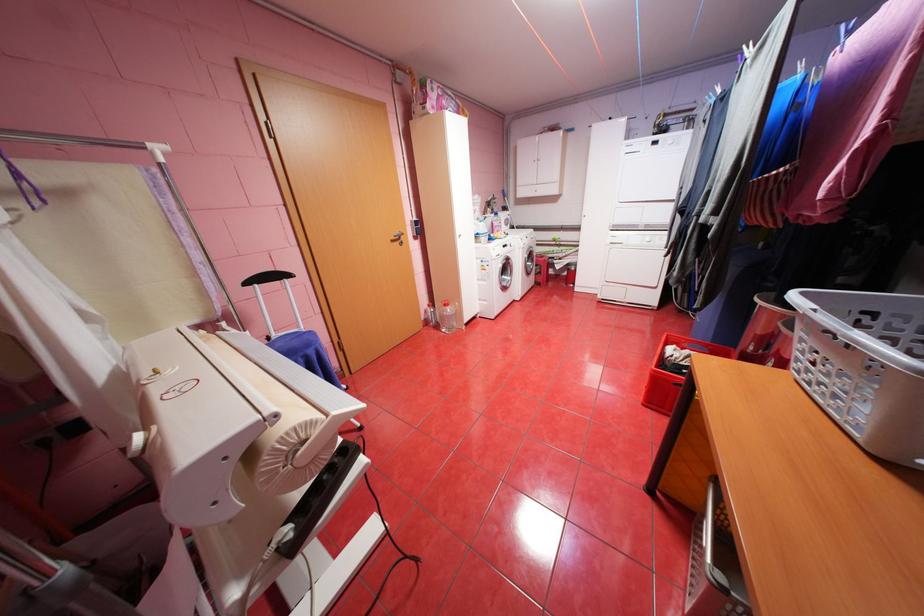
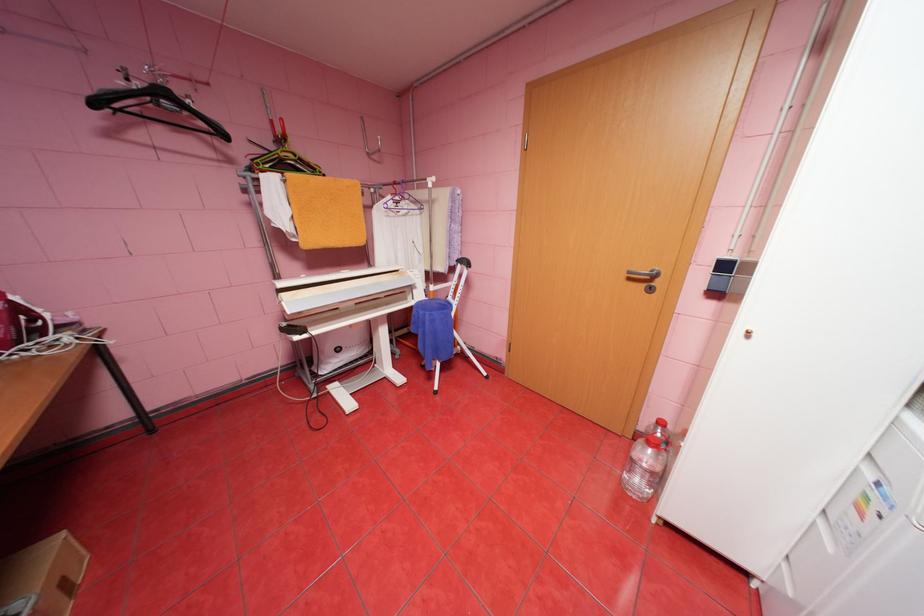
Locate, in the second image, the point that corresponds to point (407, 243) in the first image.

(650, 285)